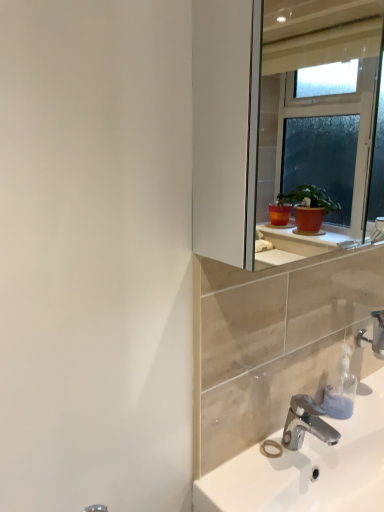
Question: From the image's perspective, is white glossy sink at lower right beneath translucent plastic soap dispenser at lower right?

Choices:
 (A) yes
 (B) no

Answer: (A)

Question: Considering the relative positions of white glossy sink at lower right and translucent plastic soap dispenser at lower right in the image provided, is white glossy sink at lower right to the left of translucent plastic soap dispenser at lower right from the viewer's perspective?

Choices:
 (A) no
 (B) yes

Answer: (A)

Question: Can you confirm if white glossy sink at lower right is smaller than translucent plastic soap dispenser at lower right?

Choices:
 (A) yes
 (B) no

Answer: (B)

Question: Is white glossy sink at lower right to the right of translucent plastic soap dispenser at lower right from the viewer's perspective?

Choices:
 (A) yes
 (B) no

Answer: (A)

Question: Is translucent plastic soap dispenser at lower right a part of white glossy sink at lower right?

Choices:
 (A) yes
 (B) no

Answer: (B)

Question: Is white glossy sink at lower right taller than translucent plastic soap dispenser at lower right?

Choices:
 (A) no
 (B) yes

Answer: (A)

Question: From a real-world perspective, is chrome metallic faucet at lower right, which ranks as the second tap in right-to-left order, located higher than white glossy sink at lower right?

Choices:
 (A) yes
 (B) no

Answer: (A)

Question: Is chrome metallic faucet at lower right, placed as the second tap when sorted from back to front, outside of white glossy sink at lower right?

Choices:
 (A) yes
 (B) no

Answer: (A)

Question: Is chrome metallic faucet at lower right, placed as the second tap when sorted from back to front, bigger than white glossy sink at lower right?

Choices:
 (A) no
 (B) yes

Answer: (A)

Question: From the image's perspective, does chrome metallic faucet at lower right, the 1th tap ordered from the bottom, appear higher than white glossy sink at lower right?

Choices:
 (A) yes
 (B) no

Answer: (A)

Question: From the image's perspective, is chrome metallic faucet at lower right, placed as the second tap when sorted from back to front, beneath white glossy sink at lower right?

Choices:
 (A) yes
 (B) no

Answer: (B)

Question: Is chrome metallic faucet at lower right, the 1th tap ordered from the bottom, oriented towards white glossy sink at lower right?

Choices:
 (A) yes
 (B) no

Answer: (B)

Question: Can silver metallic faucet at lower right, the 1th tap viewed from the top, be found inside white glossy sink at lower right?

Choices:
 (A) no
 (B) yes

Answer: (A)